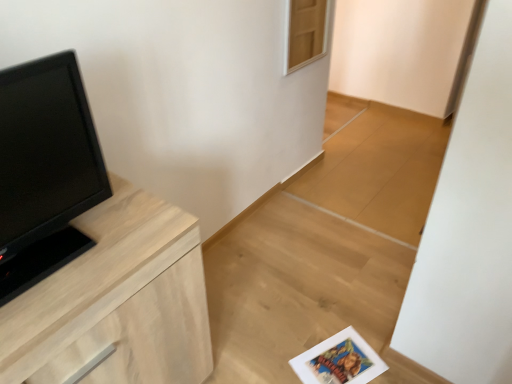
This screenshot has height=384, width=512. Identify the location of vacant region to the right of black matte tv at left. (133, 241).